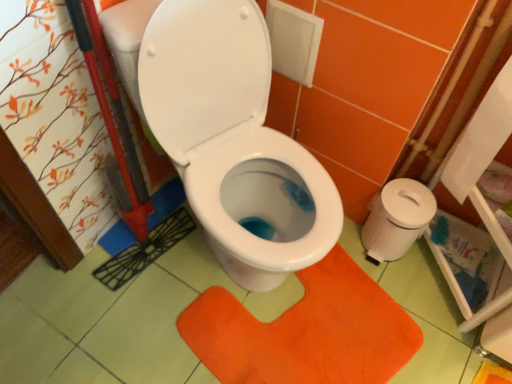
Question: Would you consider orange textured mat at center to be distant from white paper at right, which is the second toilet paper from back to front?

Choices:
 (A) no
 (B) yes

Answer: (A)

Question: Is orange textured mat at center thinner than white paper at right, acting as the 1th toilet paper starting from the front?

Choices:
 (A) no
 (B) yes

Answer: (A)

Question: Is orange textured mat at center further to camera compared to white paper at right, which is the second toilet paper from back to front?

Choices:
 (A) no
 (B) yes

Answer: (B)

Question: From the image's perspective, is orange textured mat at center on white paper at right, acting as the 1th toilet paper starting from the front?

Choices:
 (A) no
 (B) yes

Answer: (A)

Question: Does orange textured mat at center appear on the right side of white paper at right, acting as the 1th toilet paper starting from the front?

Choices:
 (A) no
 (B) yes

Answer: (A)

Question: From the image's perspective, would you say orange textured mat at center is shown under white paper at right, acting as the 1th toilet paper starting from the front?

Choices:
 (A) no
 (B) yes

Answer: (B)

Question: Does white plastic toilet paper at right, positioned as the 1th toilet paper in back-to-front order, have a lesser height compared to white paper at right, which is the second toilet paper from back to front?

Choices:
 (A) no
 (B) yes

Answer: (B)

Question: Is white plastic toilet paper at right, which is the 2th toilet paper from front to back, at the left side of white paper at right, acting as the 1th toilet paper starting from the front?

Choices:
 (A) yes
 (B) no

Answer: (A)

Question: Could you tell me if white plastic toilet paper at right, positioned as the 1th toilet paper in back-to-front order, is turned towards white paper at right, which is the second toilet paper from back to front?

Choices:
 (A) no
 (B) yes

Answer: (A)

Question: Can you confirm if white plastic toilet paper at right, which is the 2th toilet paper from front to back, is positioned to the right of white paper at right, which is the second toilet paper from back to front?

Choices:
 (A) yes
 (B) no

Answer: (B)

Question: Is white plastic toilet paper at right, which is the 2th toilet paper from front to back, behind white paper at right, which is the second toilet paper from back to front?

Choices:
 (A) yes
 (B) no

Answer: (A)

Question: Can you confirm if white plastic toilet paper at right, positioned as the 1th toilet paper in back-to-front order, is wider than white paper at right, which is the second toilet paper from back to front?

Choices:
 (A) no
 (B) yes

Answer: (B)

Question: Can you confirm if white plastic toilet paper at right, which is the 2th toilet paper from front to back, is thinner than orange textured mat at center?

Choices:
 (A) no
 (B) yes

Answer: (B)